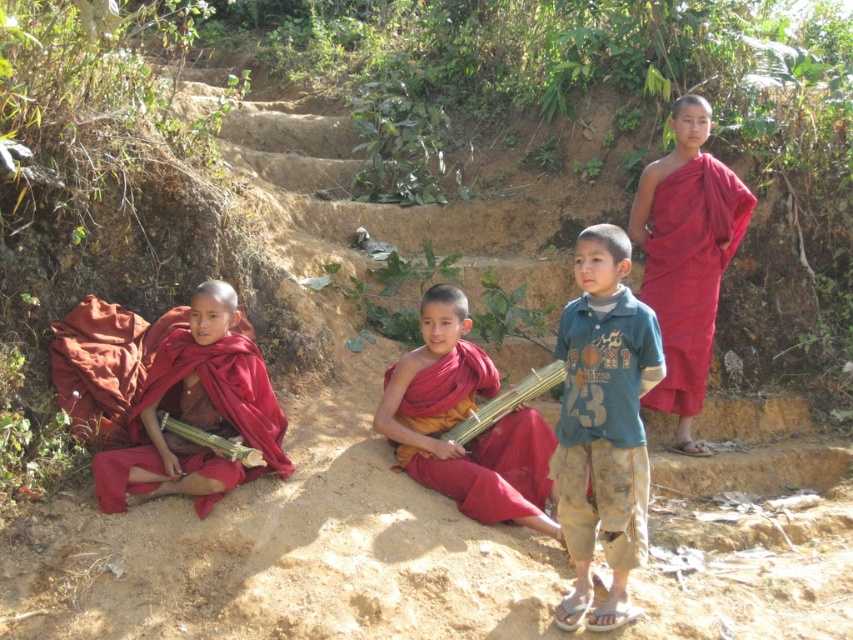
You are a photographer trying to capture a wide shot of the scene. The camera you are using has a maximum focus range of 10 feet. Can you include both the matte red robe at upper right and the matte red robe at lower left in the same focused shot?

The matte red robe at upper right is 9.55 feet from the matte red robe at lower left. Since the distance between them is within the camera maximum focus range of 10 feet, you can include both in the same focused shot.